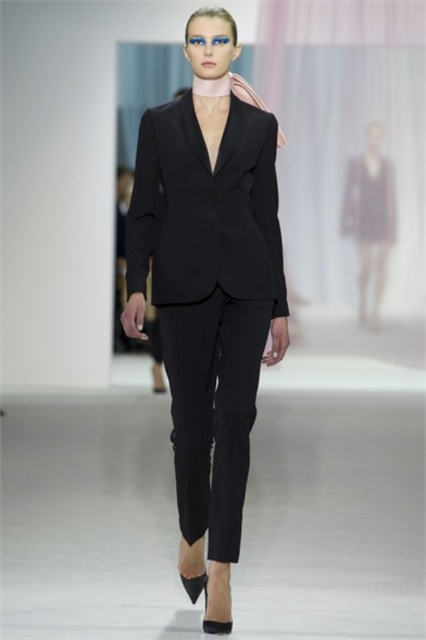
Question: Which point is farther to the camera?

Choices:
 (A) purple satin dress at center
 (B) matte black dress at right
 (C) matte black suit at center

Answer: (A)

Question: Does matte black suit at center lie behind purple satin dress at center?

Choices:
 (A) no
 (B) yes

Answer: (A)

Question: Which object is the farthest from the matte black suit at center?

Choices:
 (A) purple satin dress at center
 (B) matte black dress at right

Answer: (B)

Question: Where is matte black suit at center located in relation to purple satin dress at center in the image?

Choices:
 (A) left
 (B) right

Answer: (A)

Question: Which object is the farthest from the matte black dress at right?

Choices:
 (A) purple satin dress at center
 (B) matte black suit at center

Answer: (B)

Question: Can you confirm if matte black suit at center is positioned to the right of matte black dress at right?

Choices:
 (A) no
 (B) yes

Answer: (A)